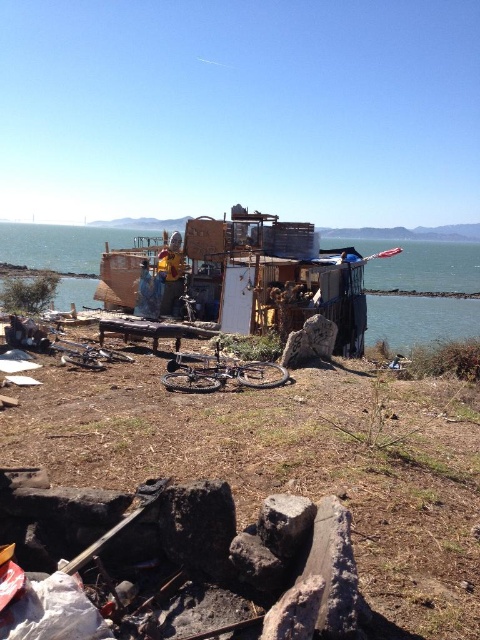
Based on the photo, does brown dirt at lower center appear under blue water at center?

Indeed, brown dirt at lower center is positioned under blue water at center.

Which of these two, brown dirt at lower center or blue water at center, stands taller?

blue water at center

Image resolution: width=480 pixels, height=640 pixels. What do you see at coordinates (290, 461) in the screenshot?
I see `brown dirt at lower center` at bounding box center [290, 461].

Locate an element on the screen. This screenshot has width=480, height=640. brown dirt at lower center is located at coordinates (290, 461).

Which is behind, point (376, 285) or point (299, 497)?

Positioned behind is point (376, 285).

Does blue water at center have a smaller size compared to gray rough stone at center?

Incorrect, blue water at center is not smaller in size than gray rough stone at center.

Does point (363, 250) come behind point (282, 532)?

Yes, it is behind point (282, 532).

This screenshot has width=480, height=640. I want to click on blue water at center, so click(420, 266).

Is gray rough stone at center taller than yellow fabric shirt at center?

Incorrect, gray rough stone at center's height is not larger of yellow fabric shirt at center's.

Who is taller, gray rough stone at center or yellow fabric shirt at center?

yellow fabric shirt at center is taller.

Describe the element at coordinates (285, 522) in the screenshot. I see `gray rough stone at center` at that location.

The width and height of the screenshot is (480, 640). Identify the location of gray rough stone at center. (285, 522).